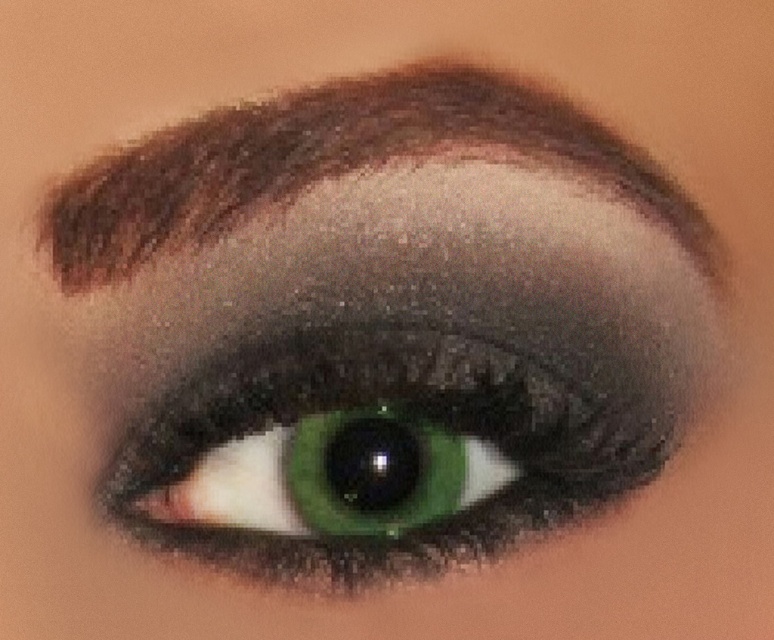
Is shiny green eye at center to the left of smokey brown eyebrow at upper center from the viewer's perspective?

In fact, shiny green eye at center is to the right of smokey brown eyebrow at upper center.

Where is `shiny green eye at center`? The image size is (774, 640). shiny green eye at center is located at coordinates (379, 451).